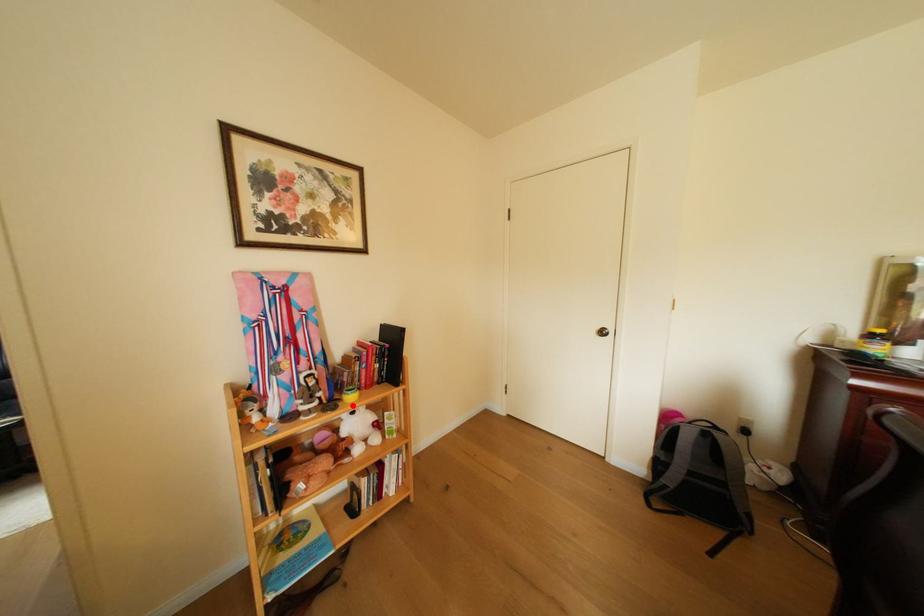
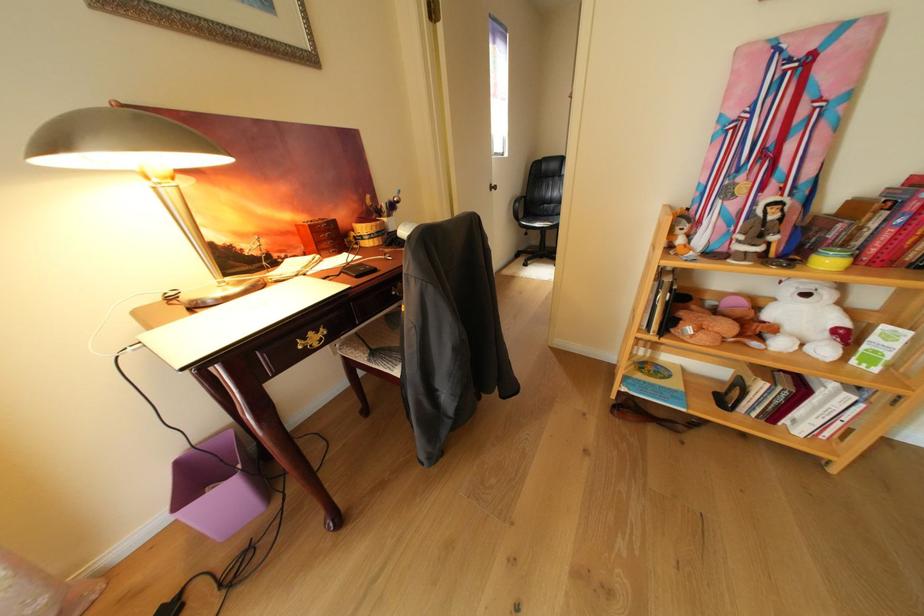
Find the pixel in the second image that matches the highlighted location in the first image.

(811, 267)